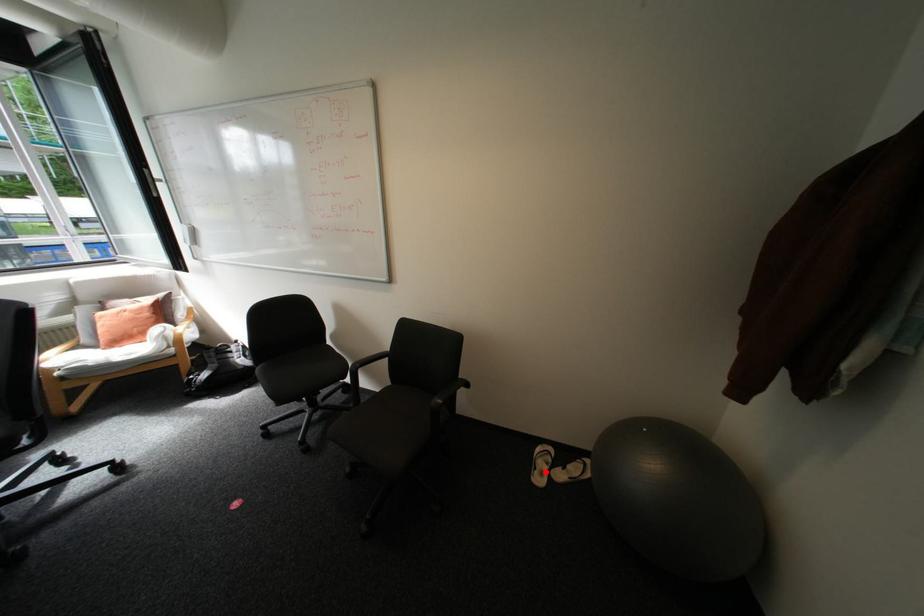
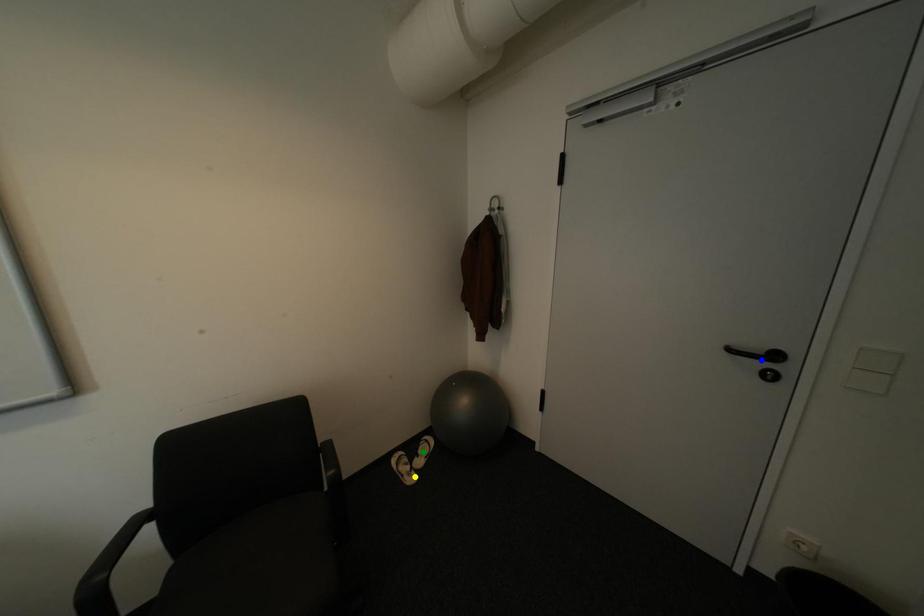
Question: I am providing you with two images of the same scene from different viewpoints. A red point is marked on the first image. You are given multiple points on the second image. In image 2, which mark is for the same physical point as the one in image 1?

Choices:
 (A) green point
 (B) yellow point
 (C) blue point

Answer: (B)